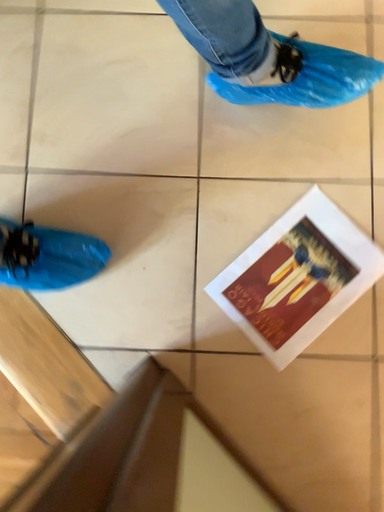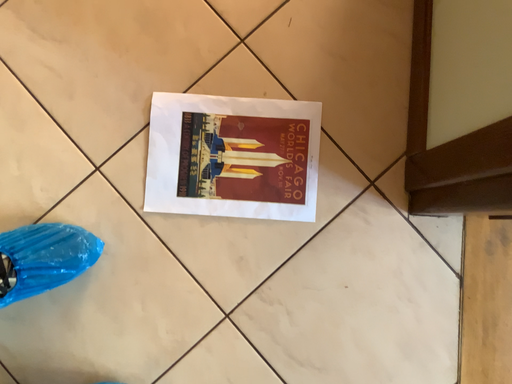
Question: How did the camera likely rotate when shooting the video?

Choices:
 (A) rotated upward
 (B) rotated downward

Answer: (A)